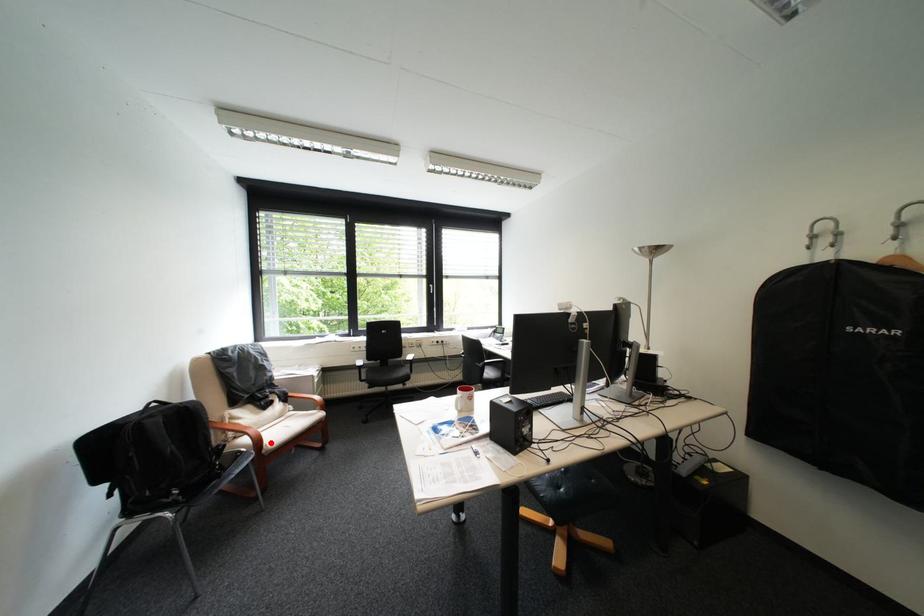
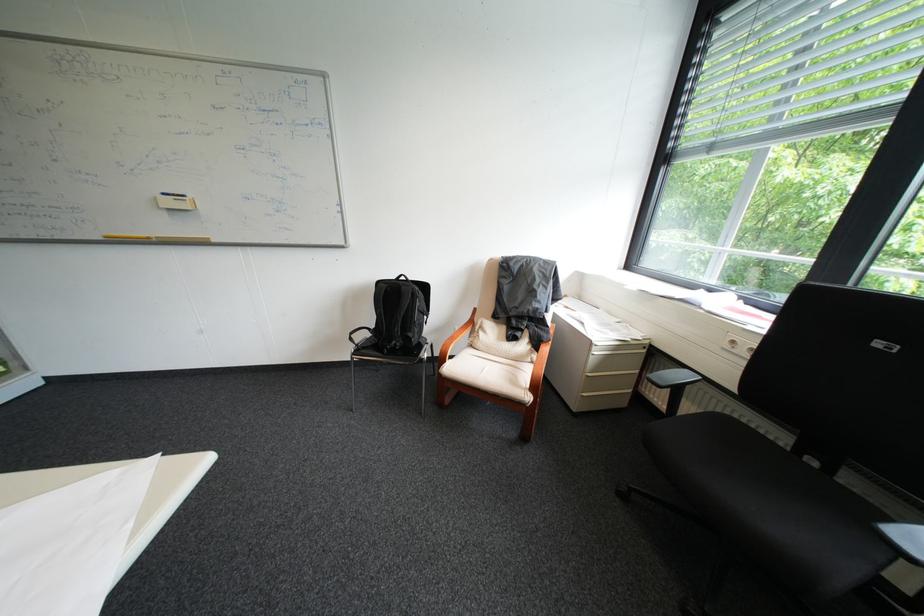
Question: A red point is marked in image1. In image2, is the corresponding 3D point closer to the camera or farther? Reply with the corresponding letter.

Choices:
 (A) The corresponding 3D point is closer.
 (B) The corresponding 3D point is farther.

Answer: (B)